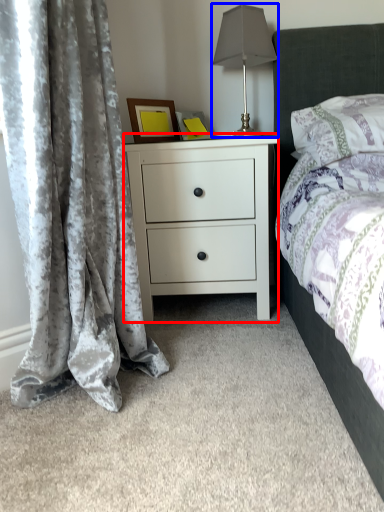
Question: Which point is closer to the camera, nightstand (highlighted by a red box) or table lamp (highlighted by a blue box)?

Choices:
 (A) nightstand
 (B) table lamp

Answer: (A)